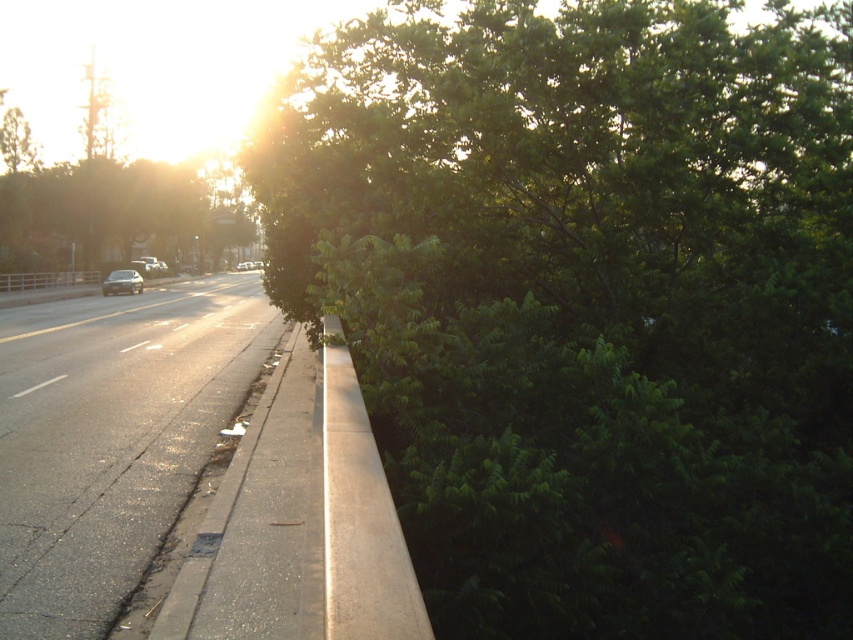
You are standing at the point closest to the camera in the image. There are two points marked in the scene, one at coordinates point [827,128] and another at point [56,467]. Which of these points is farther away from your current position?

Point [56,467] is farther away from your current position because it is located further away from the viewer compared to point [827,128], which is closer.

You are a pedestrian standing on the sidewalk. You see the asphalt road at lower left and the satin silver sedan at left. Which object is closer to the ground?

The asphalt road at lower left is positioned under the satin silver sedan at left, so the asphalt road at lower left is closer to the ground.